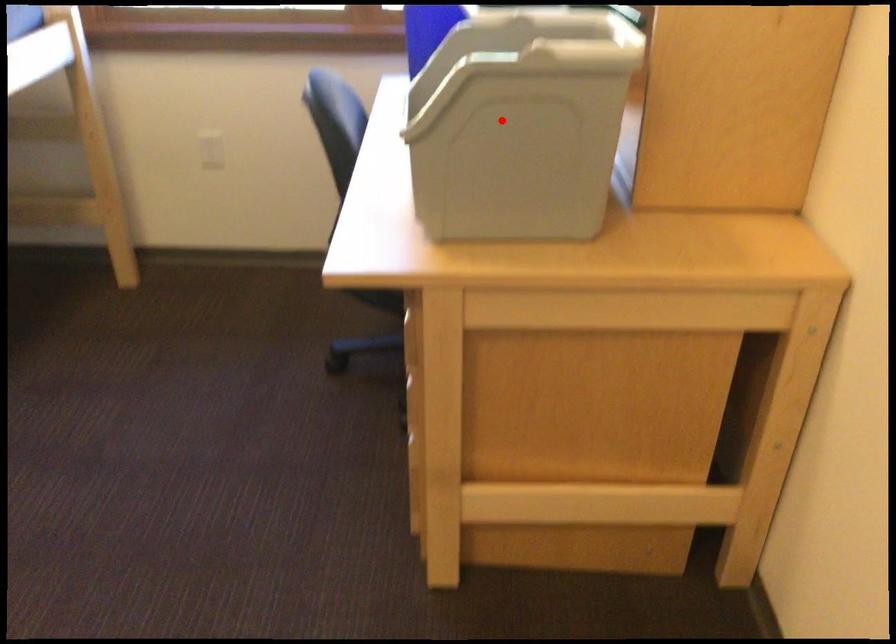
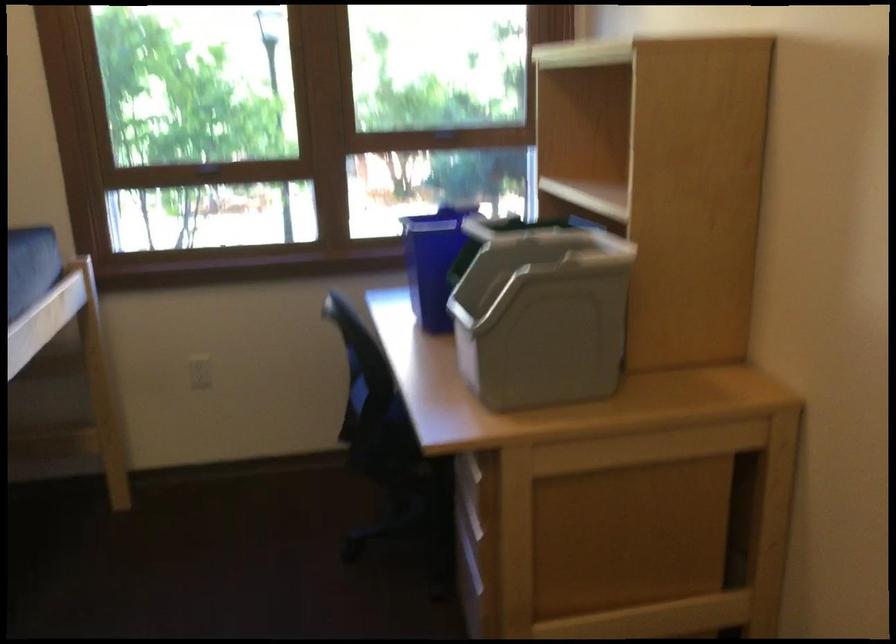
Question: I am providing you with two images of the same scene from different viewpoints. Image1 has a red point marked. In image2, the corresponding 3D location appears at what relative position? Reply with the corresponding letter.

Choices:
 (A) Closer
 (B) Farther

Answer: (B)